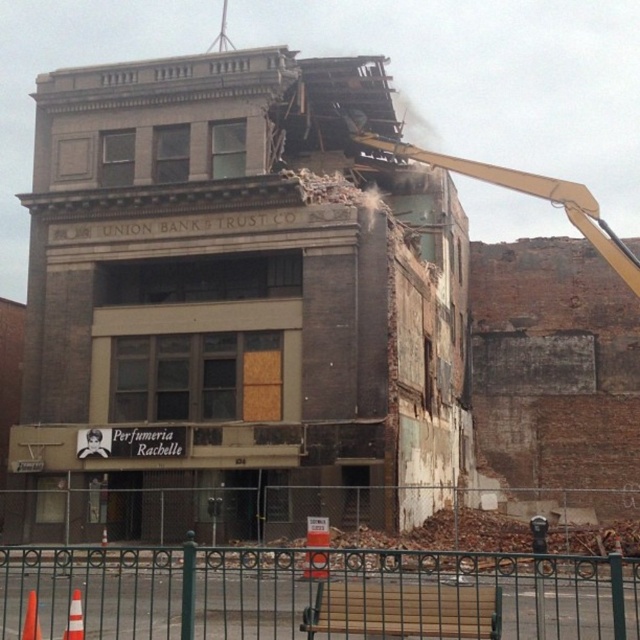
You are a construction worker who needs to place a new safety barrier between the wooden bench at lower center and the white plastic construction worker at center. Based on their sizes, which object requires more space for the barrier?

The wooden bench at lower center might require more space for the barrier since it might be wider than the white plastic construction worker at center.

You are standing in front of the partially demolished building. There are two points marked on the building. One is at coordinate point (460, 554) and the other is at point (81, 432). Which point is closer to you?

Point (460, 554) is closer to the viewer than point (81, 432).